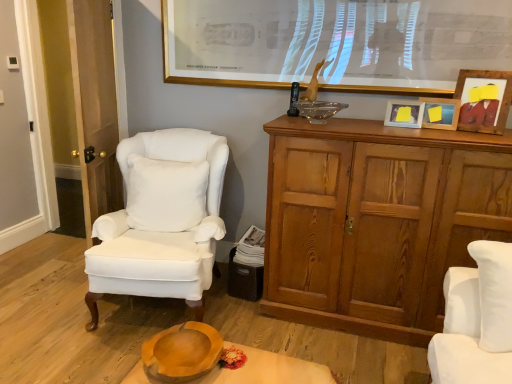
Question: Should I look upward or downward to see white velvet pillow at center?

Choices:
 (A) up
 (B) down

Answer: (B)

Question: Considering the relative sizes of wooden picture frame at upper right, acting as the 1th picture frame starting from the right, and transparent glass bowl at upper center in the image provided, is wooden picture frame at upper right, acting as the 1th picture frame starting from the right, bigger than transparent glass bowl at upper center?

Choices:
 (A) yes
 (B) no

Answer: (A)

Question: Is wooden picture frame at upper right, which is the fourth picture frame from left to right, positioned in front of transparent glass bowl at upper center?

Choices:
 (A) no
 (B) yes

Answer: (B)

Question: From the image's perspective, is wooden picture frame at upper right, which is the fourth picture frame from left to right, below transparent glass bowl at upper center?

Choices:
 (A) yes
 (B) no

Answer: (B)

Question: From a real-world perspective, is wooden picture frame at upper right, acting as the 1th picture frame starting from the right, over transparent glass bowl at upper center?

Choices:
 (A) no
 (B) yes

Answer: (B)

Question: From a real-world perspective, is wooden picture frame at upper right, which is the fourth picture frame from left to right, physically below transparent glass bowl at upper center?

Choices:
 (A) no
 (B) yes

Answer: (A)

Question: Is wooden picture frame at upper right, acting as the 1th picture frame starting from the right, to the left of transparent glass bowl at upper center from the viewer's perspective?

Choices:
 (A) no
 (B) yes

Answer: (A)

Question: Is wooden picture frame at upper right, acting as the 1th picture frame starting from the right, completely or partially outside of black plastic remote control at upper center?

Choices:
 (A) no
 (B) yes

Answer: (B)

Question: Is the depth of wooden picture frame at upper right, acting as the 1th picture frame starting from the right, less than that of black plastic remote control at upper center?

Choices:
 (A) no
 (B) yes

Answer: (B)

Question: Is wooden picture frame at upper right, acting as the 1th picture frame starting from the right, directly adjacent to black plastic remote control at upper center?

Choices:
 (A) no
 (B) yes

Answer: (A)

Question: Does wooden picture frame at upper right, acting as the 1th picture frame starting from the right, have a smaller size compared to black plastic remote control at upper center?

Choices:
 (A) no
 (B) yes

Answer: (A)

Question: Does wooden picture frame at upper right, which is the fourth picture frame from left to right, have a lesser width compared to black plastic remote control at upper center?

Choices:
 (A) no
 (B) yes

Answer: (A)

Question: Is black plastic remote control at upper center surrounded by wooden picture frame at upper right, which is the fourth picture frame from left to right?

Choices:
 (A) yes
 (B) no

Answer: (B)

Question: Can you confirm if white matte picture frame at upper right, positioned as the 3th picture frame in right-to-left order, is bigger than white velvet pillow at center?

Choices:
 (A) no
 (B) yes

Answer: (A)